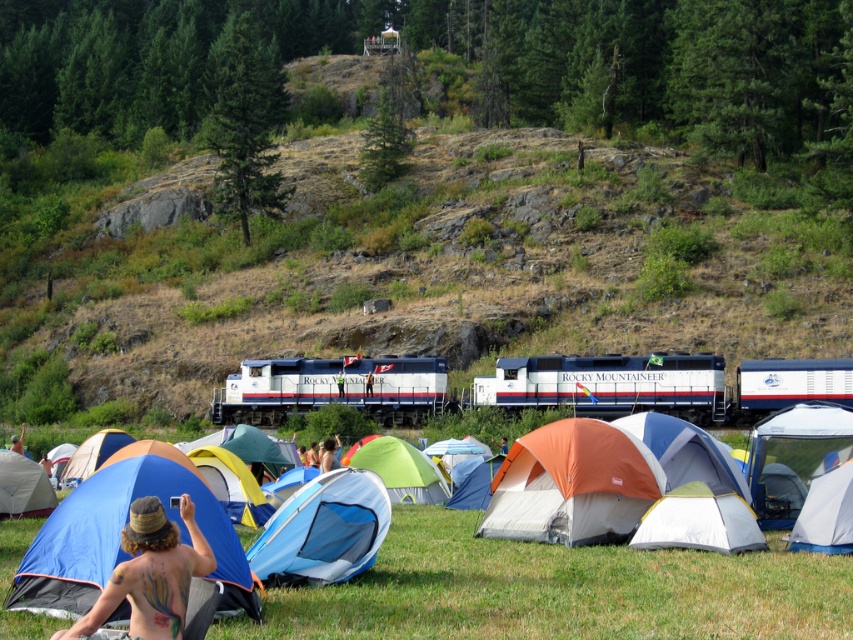
Question: Which of the following is the farthest from the observer?

Choices:
 (A) (595, 422)
 (B) (345, 484)

Answer: (A)

Question: Where is blue fabric tent at lower left located in relation to green fabric tent at center in the image?

Choices:
 (A) left
 (B) right

Answer: (A)

Question: Which point appears closest to the camera in this image?

Choices:
 (A) (828, 528)
 (B) (44, 625)
 (C) (399, 460)

Answer: (B)

Question: Can you confirm if white glossy train at center is positioned to the left of white canvas tent at center?

Choices:
 (A) no
 (B) yes

Answer: (B)

Question: Does blue fabric tent at center have a larger size compared to white canvas tent at center?

Choices:
 (A) yes
 (B) no

Answer: (A)

Question: Based on their relative distances, which object is nearer to the green grassy hillside at upper center?

Choices:
 (A) blue fabric tent at center
 (B) shiny metallic camera at center
 (C) green fabric tent at center

Answer: (C)